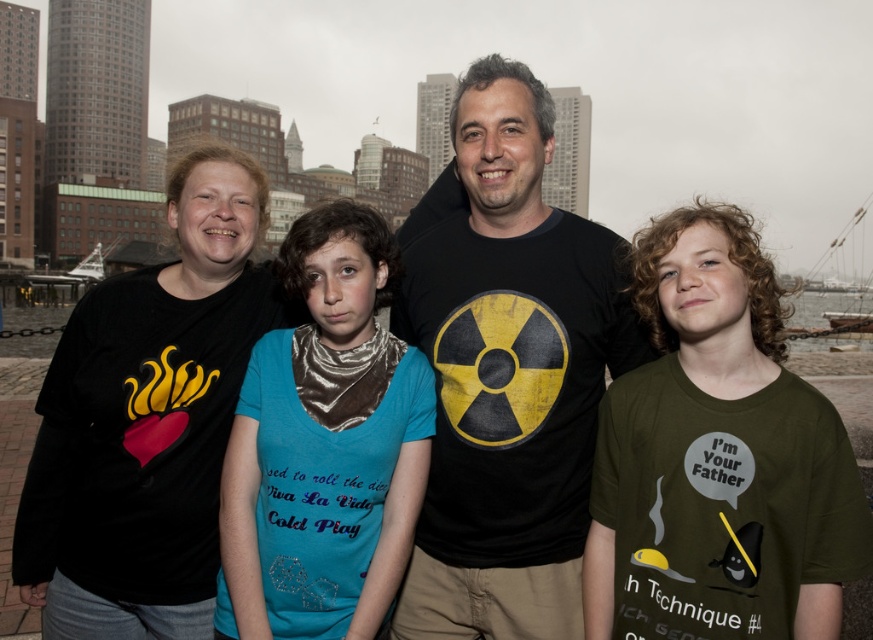
Looking at this image, can you confirm if black matte heart at left is bigger than teal fabric shirt at center?

Yes, black matte heart at left is bigger than teal fabric shirt at center.

Who is taller, black matte heart at left or teal fabric shirt at center?

With more height is black matte heart at left.

Which is in front, point (227, 429) or point (301, 440)?

Point (301, 440) is in front.

In order to click on black matte heart at left in this screenshot , I will do `click(148, 420)`.

Does black distressed t-shirt at center have a lesser width compared to black matte heart at left?

In fact, black distressed t-shirt at center might be wider than black matte heart at left.

What do you see at coordinates (506, 371) in the screenshot?
I see `black distressed t-shirt at center` at bounding box center [506, 371].

Measure the distance between point (509, 177) and camera.

Point (509, 177) is 114.66 feet from camera.

Locate an element on the screen. This screenshot has height=640, width=873. black distressed t-shirt at center is located at coordinates (506, 371).

Does olive green t-shirt at center have a greater width compared to black matte heart at left?

Yes.

Does olive green t-shirt at center have a lesser width compared to black matte heart at left?

No, olive green t-shirt at center is not thinner than black matte heart at left.

The height and width of the screenshot is (640, 873). What are the coordinates of `olive green t-shirt at center` in the screenshot? It's located at (717, 458).

At what (x,y) coordinates should I click in order to perform the action: click on olive green t-shirt at center. Please return your answer as a coordinate pair (x, y). This screenshot has width=873, height=640. Looking at the image, I should click on (717, 458).